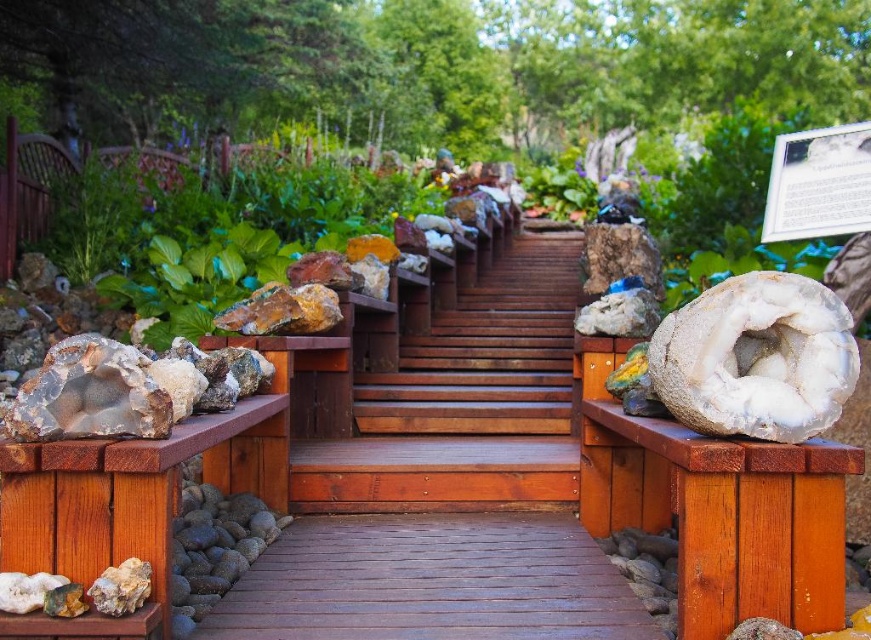
You are a visitor standing at the bottom of the brown wooden stairs at center and want to place a small potted plant on the translucent white crystal at center. Considering their heights, can you determine if the crystal will support the plant without it toppling over?

The brown wooden stairs at center has a greater height compared to the translucent white crystal at center. Since the crystal is shorter, placing the potted plant on it may not provide enough stability, so it might topple over.

You are a geologist examining the specimens on the wooden platforms next to the staircase. You notice the translucent white crystal at center and the gray rock at lower left. Which specimen is taller?

The translucent white crystal at center is taller than the gray rock at lower left.